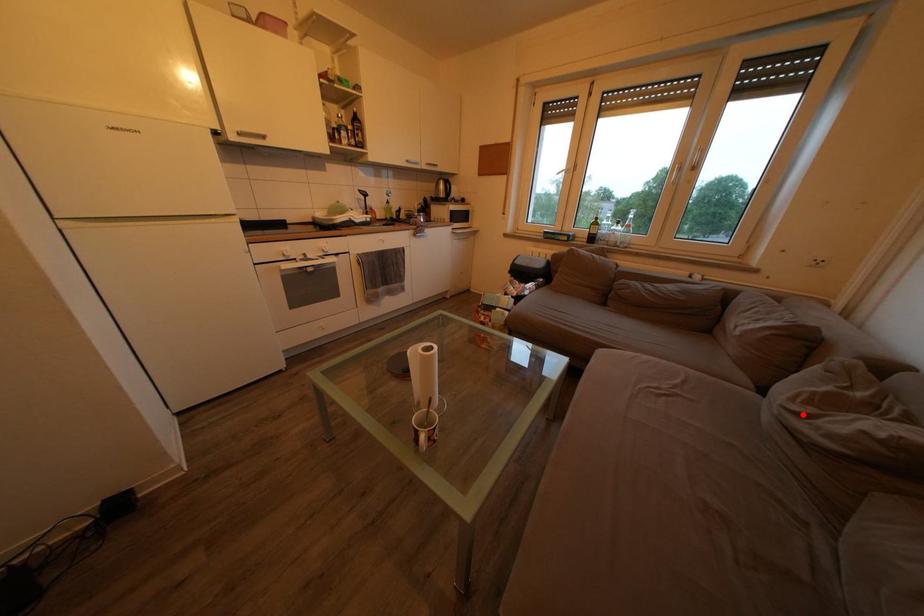
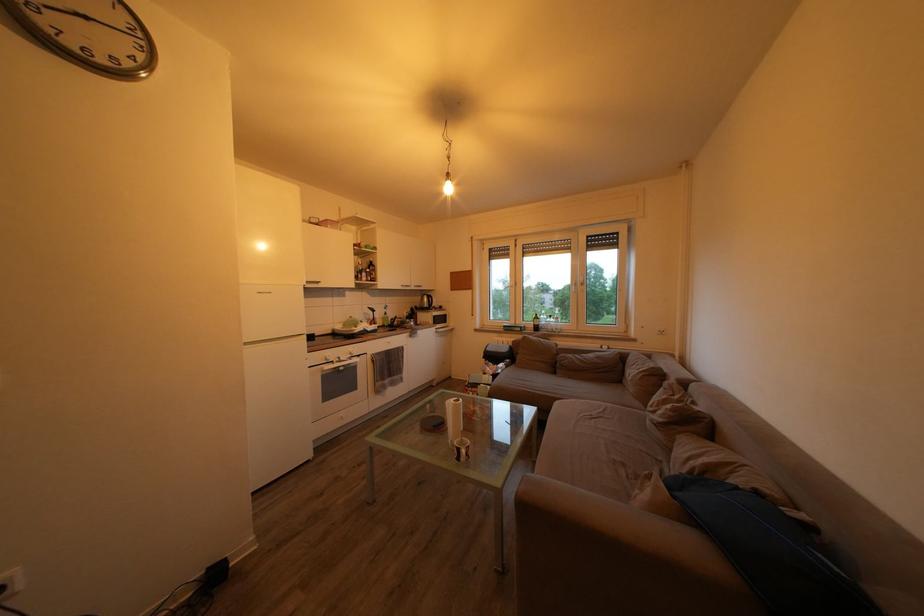
Question: A red point is marked in image1. In image2, is the corresponding 3D point closer to the camera or farther? Reply with the corresponding letter.

Choices:
 (A) The corresponding 3D point is closer.
 (B) The corresponding 3D point is farther.

Answer: (A)